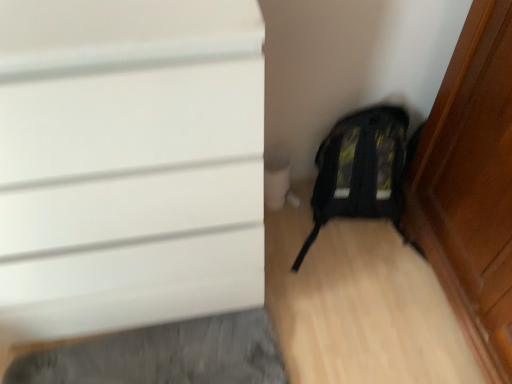
Describe the element at coordinates (362, 169) in the screenshot. The height and width of the screenshot is (384, 512). I see `black fabric backpack at lower right` at that location.

Locate an element on the screen. This screenshot has height=384, width=512. black fabric backpack at lower right is located at coordinates (362, 169).

Measure the distance between white matte door at upper left and camera.

A distance of 22.13 inches exists between white matte door at upper left and camera.

This screenshot has height=384, width=512. What do you see at coordinates (128, 163) in the screenshot?
I see `white matte door at upper left` at bounding box center [128, 163].

This screenshot has height=384, width=512. Find the location of `white matte door at upper left`. white matte door at upper left is located at coordinates (128, 163).

Identify the location of black fabric backpack at lower right. This screenshot has height=384, width=512. (362, 169).

Considering the positions of objects black fabric backpack at lower right and white matte door at upper left in the image provided, who is more to the right, black fabric backpack at lower right or white matte door at upper left?

black fabric backpack at lower right.

From the picture: Is black fabric backpack at lower right in front of or behind white matte door at upper left in the image?

In the image, black fabric backpack at lower right appears behind white matte door at upper left.

Does point (386, 211) lie behind point (55, 242)?

Yes, it is behind point (55, 242).

From the image's perspective, is black fabric backpack at lower right located beneath white matte door at upper left?

Yes, from the image's perspective, black fabric backpack at lower right is below white matte door at upper left.

From a real-world perspective, which object stands above the other?

white matte door at upper left, from a real-world perspective.

Consider the image. Which object is thinner, black fabric backpack at lower right or white matte door at upper left?

black fabric backpack at lower right is thinner.

Is black fabric backpack at lower right taller than white matte door at upper left?

No.

Considering the relative sizes of black fabric backpack at lower right and white matte door at upper left in the image provided, is black fabric backpack at lower right bigger than white matte door at upper left?

No, black fabric backpack at lower right is not bigger than white matte door at upper left.

Consider the image. Is black fabric backpack at lower right not within white matte door at upper left?

Yes.

Would you say black fabric backpack at lower right is a long distance from white matte door at upper left?

No, black fabric backpack at lower right is in close proximity to white matte door at upper left.

Is white matte door at upper left at the back of black fabric backpack at lower right?

No, black fabric backpack at lower right is not facing away from white matte door at upper left.

Based on the photo, can you tell me how much black fabric backpack at lower right and white matte door at upper left differ in facing direction?

black fabric backpack at lower right and white matte door at upper left are facing 3.31 degrees away from each other.

How far apart are black fabric backpack at lower right and white matte door at upper left?

black fabric backpack at lower right and white matte door at upper left are 25.10 inches apart from each other.

This screenshot has width=512, height=384. In order to click on backpack located below the white matte door at upper left (from the image's perspective) in this screenshot , I will do `click(362, 169)`.

Can you confirm if white matte door at upper left is positioned to the left of black fabric backpack at lower right?

Yes, white matte door at upper left is to the left of black fabric backpack at lower right.

Who is more distant, white matte door at upper left or black fabric backpack at lower right?

Positioned behind is black fabric backpack at lower right.

Considering the points (163, 257) and (422, 123), which point is in front, point (163, 257) or point (422, 123)?

Point (163, 257)

From the image's perspective, who appears lower, white matte door at upper left or black fabric backpack at lower right?

From the image's view, black fabric backpack at lower right is below.

From a real-world perspective, which object rests below the other?

black fabric backpack at lower right, from a real-world perspective.

Considering the relative sizes of white matte door at upper left and black fabric backpack at lower right in the image provided, is white matte door at upper left wider than black fabric backpack at lower right?

Yes.

Considering the sizes of objects white matte door at upper left and black fabric backpack at lower right in the image provided, who is shorter, white matte door at upper left or black fabric backpack at lower right?

black fabric backpack at lower right is shorter.

Considering the relative sizes of white matte door at upper left and black fabric backpack at lower right in the image provided, is white matte door at upper left smaller than black fabric backpack at lower right?

Incorrect, white matte door at upper left is not smaller in size than black fabric backpack at lower right.

From the picture: Is white matte door at upper left inside or outside of black fabric backpack at lower right?

The correct answer is: outside.

Would you consider white matte door at upper left to be distant from black fabric backpack at lower right?

white matte door at upper left is actually quite close to black fabric backpack at lower right.

Is white matte door at upper left oriented towards black fabric backpack at lower right?

No, white matte door at upper left does not turn towards black fabric backpack at lower right.

Consider the image. How different are the orientations of white matte door at upper left and black fabric backpack at lower right in degrees?

The facing directions of white matte door at upper left and black fabric backpack at lower right are 3.31 degrees apart.

Based on the photo, measure the distance between white matte door at upper left and black fabric backpack at lower right.

They are 25.10 inches apart.

You are a GUI agent. You are given a task and a screenshot of the screen. Output one action in this format:
    pyautogui.click(x=<x>, y=<y>)
    Task: Click on the door lying in front of the black fabric backpack at lower right
    The image size is (512, 384).
    Given the screenshot: What is the action you would take?
    pyautogui.click(x=128, y=163)

Locate an element on the screen. door on the left side of black fabric backpack at lower right is located at coordinates (128, 163).

There is a black fabric backpack at lower right. Where is `door above it (from a real-world perspective)`? The height and width of the screenshot is (384, 512). door above it (from a real-world perspective) is located at coordinates (128, 163).